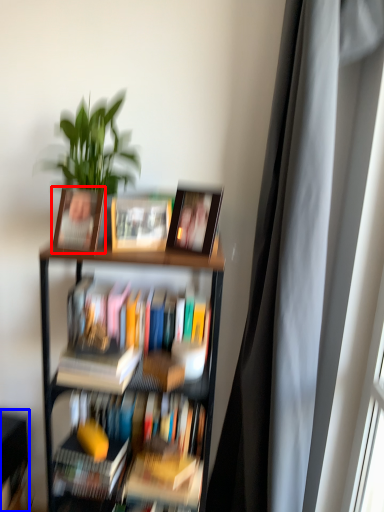
Question: Which object appears farthest to the camera in this image, picture frame (highlighted by a red box) or shelf (highlighted by a blue box)?

Choices:
 (A) picture frame
 (B) shelf

Answer: (B)